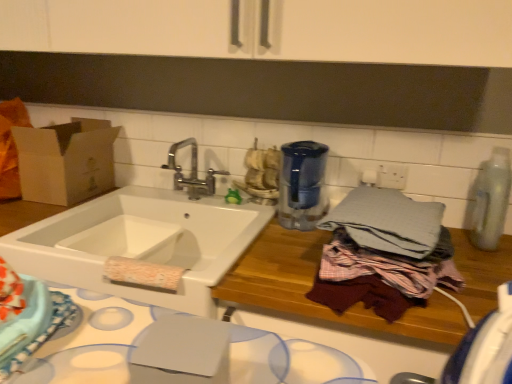
Locate an element on the screen. This screenshot has height=384, width=512. free point in front of blue glass water filter at center, acting as the second appliance starting from the right is located at coordinates (287, 246).